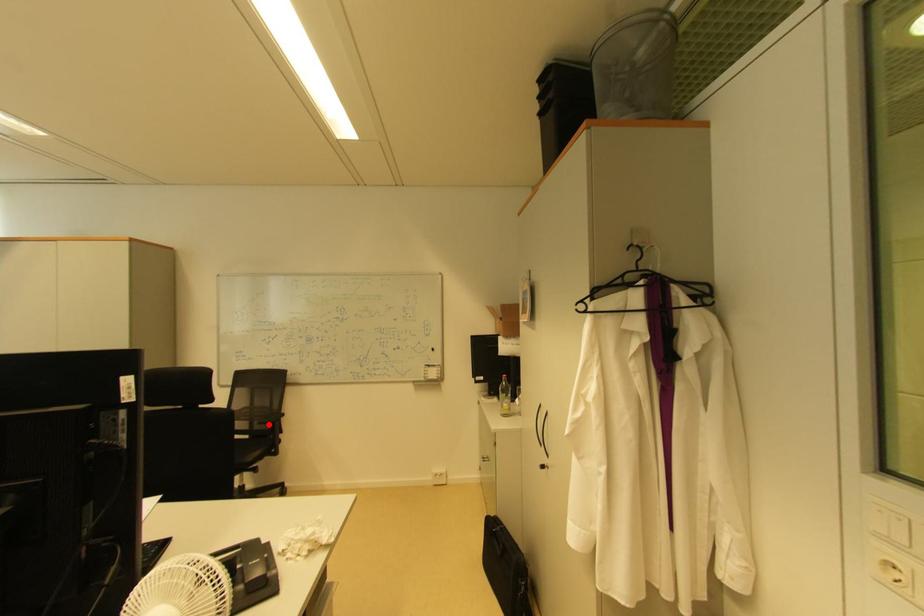
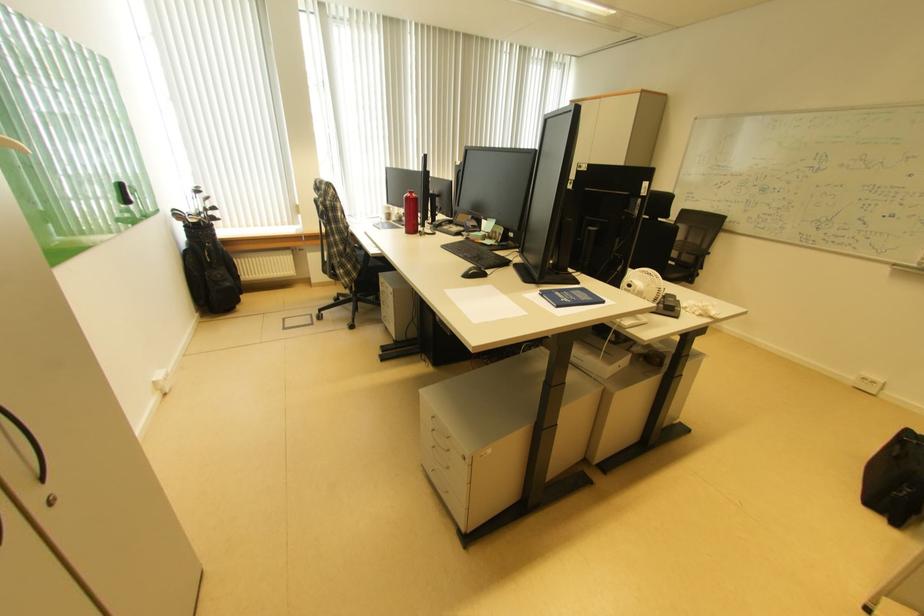
Question: I am providing you with two images of the same scene from different viewpoints. Image1 has a red point marked. In image2, the corresponding 3D location appears at what relative position? Reply with the corresponding letter.

Choices:
 (A) Closer
 (B) Farther

Answer: (A)